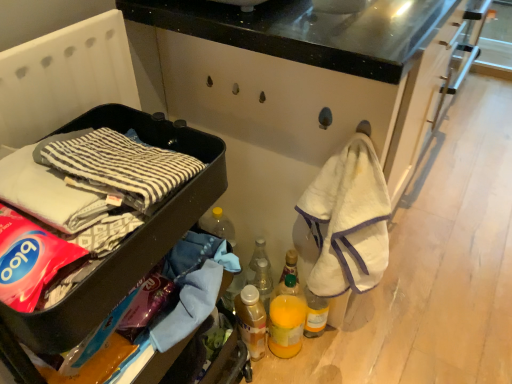
At what (x,y) coordinates should I click in order to perform the action: click on free location to the right of translucent plastic bottle at lower center, the first bottle ordered from the bottom. Please return your answer as a coordinate pair (x, y). This screenshot has width=512, height=384. Looking at the image, I should click on (316, 360).